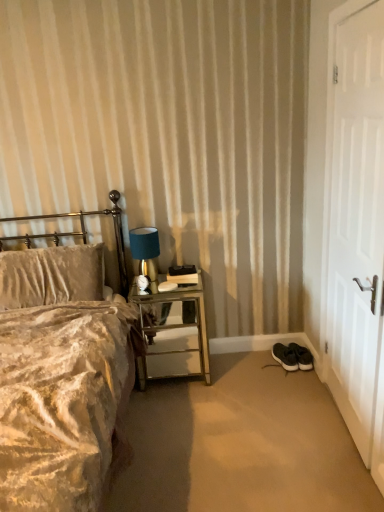
Question: From a real-world perspective, is black fabric shoes at lower right below white matte door at right?

Choices:
 (A) no
 (B) yes

Answer: (B)

Question: From the image's perspective, is black fabric shoes at lower right on white matte door at right?

Choices:
 (A) no
 (B) yes

Answer: (A)

Question: From the image's perspective, is black fabric shoes at lower right below white matte door at right?

Choices:
 (A) no
 (B) yes

Answer: (B)

Question: From a real-world perspective, is black fabric shoes at lower right located higher than white matte door at right?

Choices:
 (A) yes
 (B) no

Answer: (B)

Question: Considering the relative positions of black fabric shoes at lower right and white matte door at right in the image provided, is black fabric shoes at lower right to the left of white matte door at right from the viewer's perspective?

Choices:
 (A) yes
 (B) no

Answer: (A)

Question: Is white matte door at right surrounded by black fabric shoes at lower right?

Choices:
 (A) no
 (B) yes

Answer: (A)

Question: From a real-world perspective, does black fabric shoes at lower right stand above mirrored glass nightstand at center?

Choices:
 (A) yes
 (B) no

Answer: (B)

Question: Could you tell me if black fabric shoes at lower right is facing mirrored glass nightstand at center?

Choices:
 (A) yes
 (B) no

Answer: (B)

Question: Can we say black fabric shoes at lower right lies outside mirrored glass nightstand at center?

Choices:
 (A) yes
 (B) no

Answer: (A)

Question: Is black fabric shoes at lower right far away from mirrored glass nightstand at center?

Choices:
 (A) no
 (B) yes

Answer: (A)

Question: Is mirrored glass nightstand at center inside black fabric shoes at lower right?

Choices:
 (A) no
 (B) yes

Answer: (A)

Question: Is black fabric shoes at lower right positioned with its back to mirrored glass nightstand at center?

Choices:
 (A) no
 (B) yes

Answer: (A)

Question: Can you confirm if white matte door at right is positioned to the left of mirrored glass nightstand at center?

Choices:
 (A) no
 (B) yes

Answer: (A)